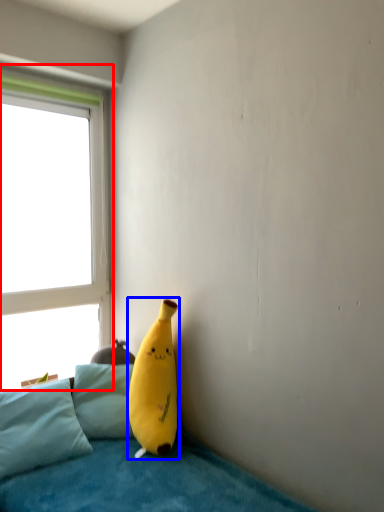
Question: Which object is further to the camera taking this photo, window (highlighted by a red box) or banana (highlighted by a blue box)?

Choices:
 (A) window
 (B) banana

Answer: (A)